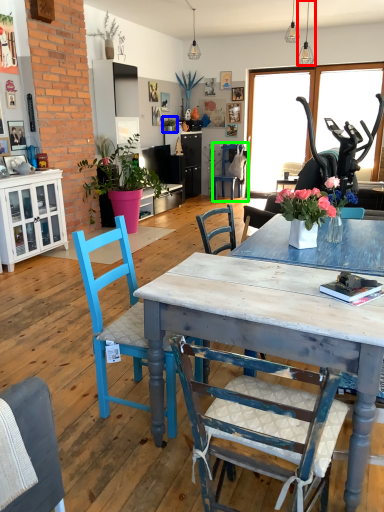
Question: Based on their relative distances, which object is farther from lamp (highlighted by a red box)? Choose from houseplant (highlighted by a blue box) and chair (highlighted by a green box).

Choices:
 (A) houseplant
 (B) chair

Answer: (A)